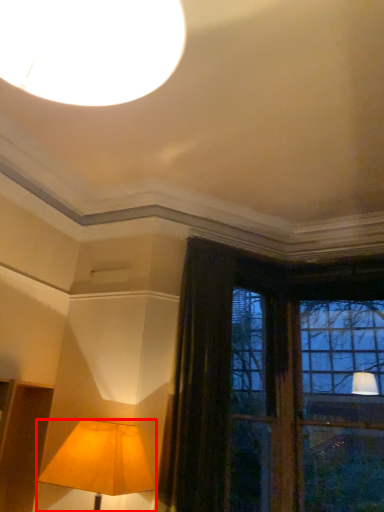
Question: Considering the relative positions of lamp (annotated by the red box) and curtain in the image provided, where is lamp (annotated by the red box) located with respect to the staircase?

Choices:
 (A) left
 (B) right

Answer: (A)